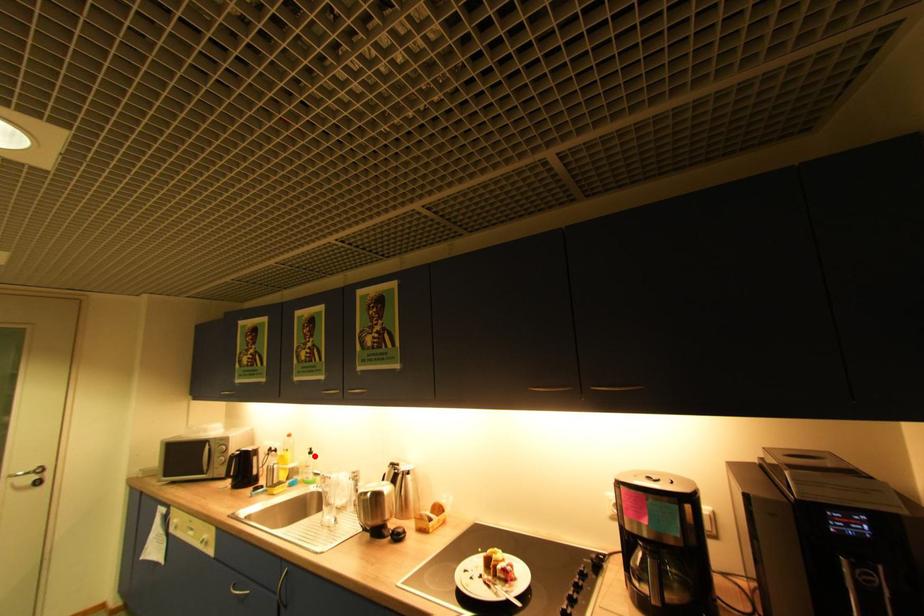
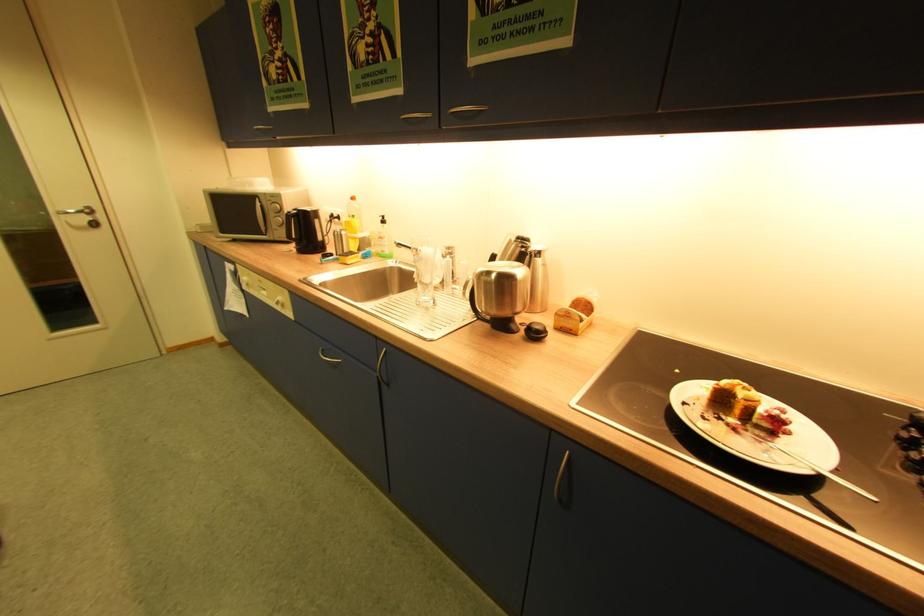
Locate, in the second image, the point that corresponds to the highlighted location in the first image.

(386, 225)